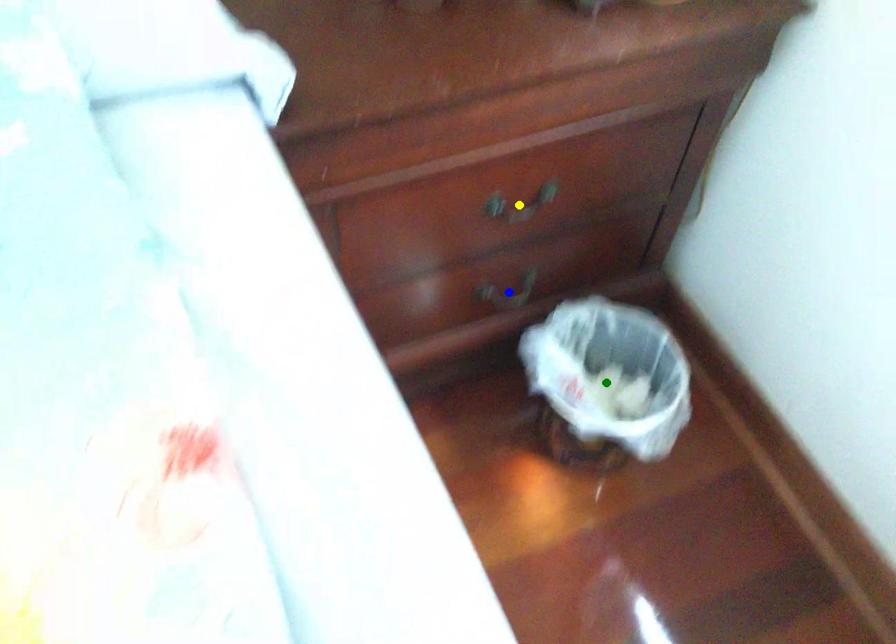
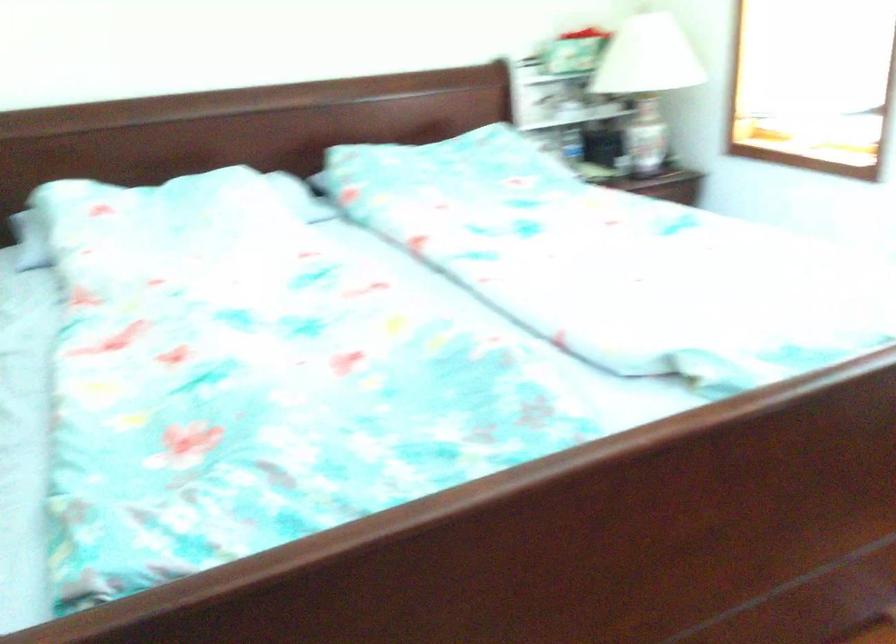
I am providing you with two images of the same scene from different viewpoints. Three points are marked in image1. Which point corresponds to a part or object that is occluded in image2?In image1, three points are marked. Which of them correspond to a part or object that is occluded in image2?Among the three points shown in image1, which one corresponds to a part or object that is no longer visible due to occlusion in image2?

Invisible in image2: yellow point, blue point, green point.